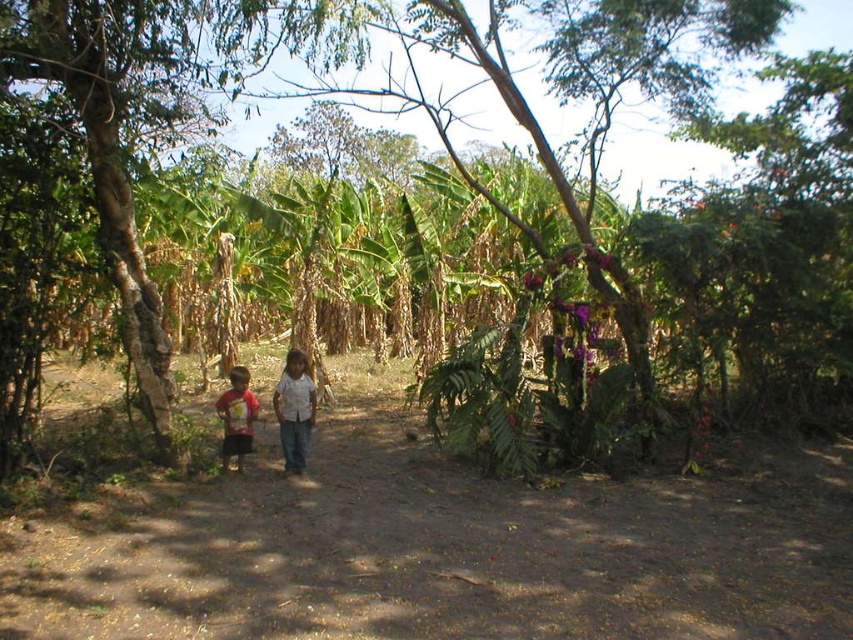
You are a hiker trying to follow the brown dirt path at center. You notice the white cotton shirt at center in the distance. Which direction should you walk to stay on the path while avoiding the shirt?

The brown dirt path at center is below the white cotton shirt at center, so you should walk in the direction away from the shirt to stay on the path.